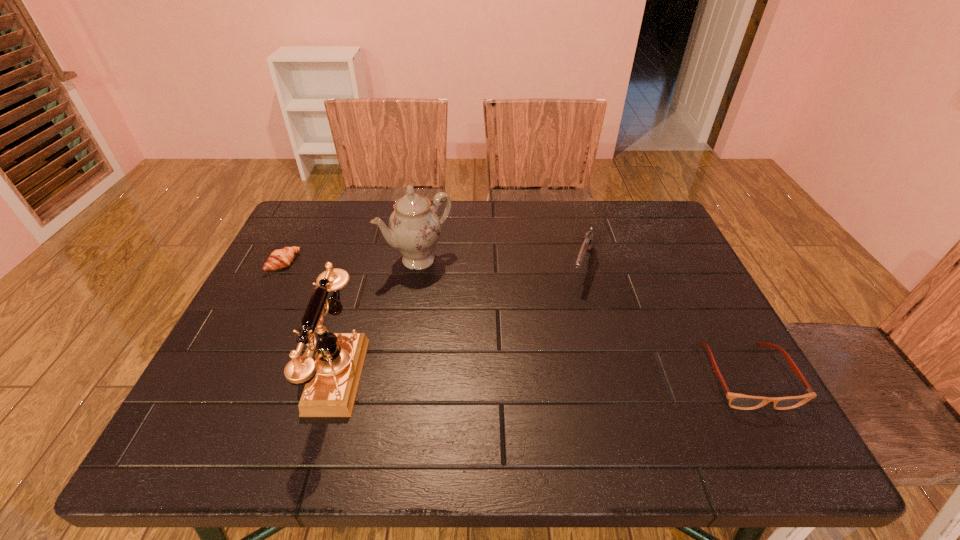
Locate an element on the screen. free point between the third tallest object and the chinaware is located at coordinates (500, 262).

You are a GUI agent. You are given a task and a screenshot of the screen. Output one action in this format:
    pyautogui.click(x=<x>, y=<y>)
    Task: Click on the vacant region between the chinaware and the telephone
    The width and height of the screenshot is (960, 540).
    Given the screenshot: What is the action you would take?
    pyautogui.click(x=375, y=316)

Select which object is the fourth closest to the third tallest object. Please provide its 2D coordinates. Your answer should be formatted as a tuple, i.e. [(x, y)], where the tuple contains the x and y coordinates of a point satisfying the conditions above.

[(280, 258)]

Find the location of a particular element. This screenshot has height=540, width=960. the fourth closest object to the shortest object is located at coordinates (737, 401).

Where is `vacant area that satisfies the following two spatial constraints: 1. on the front side of the telephone; 2. on the dial of the leftmost object`? vacant area that satisfies the following two spatial constraints: 1. on the front side of the telephone; 2. on the dial of the leftmost object is located at coordinates (228, 374).

Find the location of a particular element. This screenshot has width=960, height=540. free space that satisfies the following two spatial constraints: 1. on the front side of the third shortest object; 2. on the right side of the chinaware is located at coordinates (418, 266).

At what (x,y) coordinates should I click in order to perform the action: click on vacant region that satisfies the following two spatial constraints: 1. on the front side of the third tallest object; 2. on the right side of the chinaware. Please return your answer as a coordinate pair (x, y). This screenshot has width=960, height=540. Looking at the image, I should click on (418, 266).